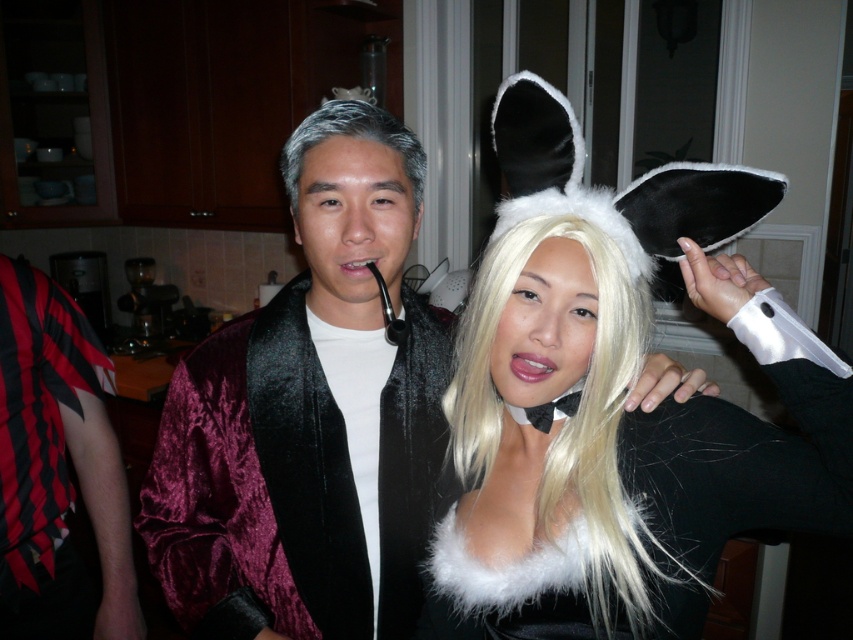
Question: Can you confirm if blonde synthetic wig at center is positioned above matte black pipe at center?

Choices:
 (A) yes
 (B) no

Answer: (B)

Question: Which point is closer to the camera?

Choices:
 (A) (42, 499)
 (B) (485, 294)
 (C) (178, 433)
 (D) (518, 374)

Answer: (D)

Question: Among these objects, which one is farthest from the camera?

Choices:
 (A) velvet burgundy jacket at center
 (B) matte black pipe at center
 (C) blonde synthetic wig at center
 (D) gray velvety wig at center

Answer: (D)

Question: Which point is farther to the camera?

Choices:
 (A) blonde synthetic wig at center
 (B) glossy matte lips at center
 (C) black striped fabric at left
 (D) gray velvety wig at center

Answer: (C)

Question: Is blonde synthetic wig at center positioned before glossy matte lips at center?

Choices:
 (A) yes
 (B) no

Answer: (A)

Question: Does glossy matte lips at center appear under matte black pipe at center?

Choices:
 (A) no
 (B) yes

Answer: (B)